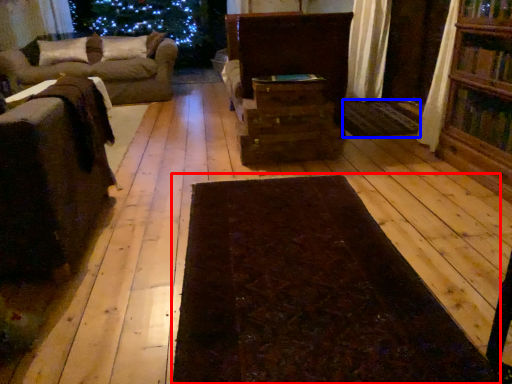
Question: Which object appears farthest to the camera in this image, mat (highlighted by a red box) or mat (highlighted by a blue box)?

Choices:
 (A) mat
 (B) mat

Answer: (B)